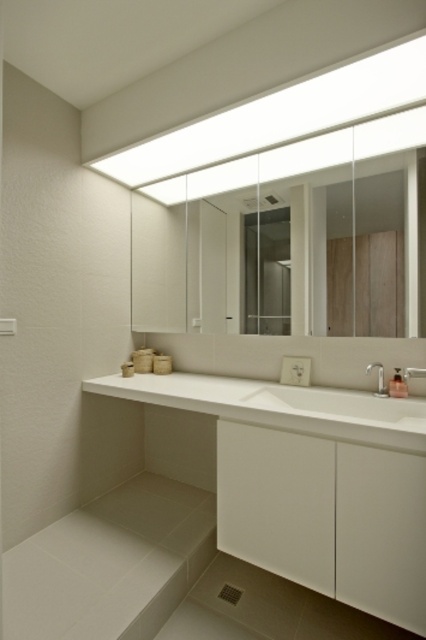
Question: Where is white glossy vanity at lower center located in relation to satin nickel faucet at right in the image?

Choices:
 (A) above
 (B) below

Answer: (B)

Question: Which point is farther from the camera taking this photo?

Choices:
 (A) (299, 515)
 (B) (382, 396)
 (C) (319, 403)

Answer: (C)

Question: Can you confirm if transparent glass mirror at upper center is positioned below satin nickel faucet at right?

Choices:
 (A) yes
 (B) no

Answer: (B)

Question: From the image, what is the correct spatial relationship of transparent glass mirror at upper center in relation to satin nickel faucet at sink right?

Choices:
 (A) below
 (B) above

Answer: (B)

Question: Which of the following is the closest to the observer?

Choices:
 (A) white glossy sink at center
 (B) satin nickel faucet at sink right

Answer: (A)

Question: Which of the following is the farthest from the observer?

Choices:
 (A) (331, 436)
 (B) (380, 381)

Answer: (B)